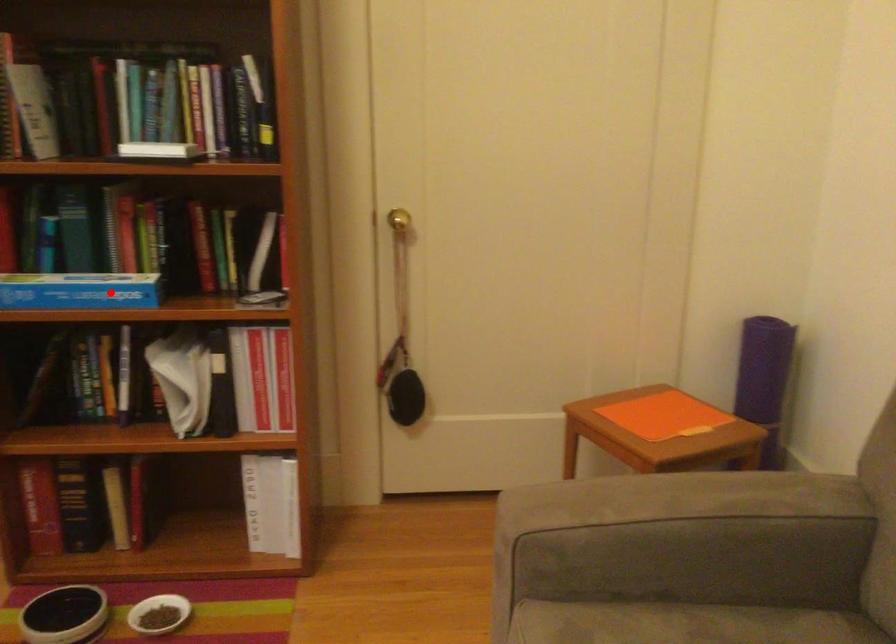
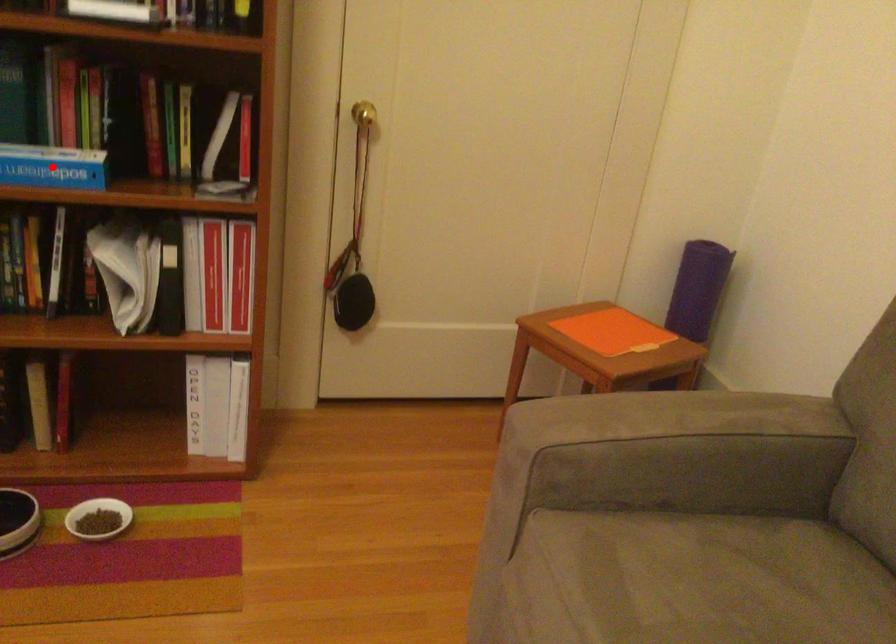
I am providing you with two images of the same scene from different viewpoints. A red point is marked on the first image and another point is marked on the second image. Is the red point in image1 aligned with the point shown in image2?

Yes